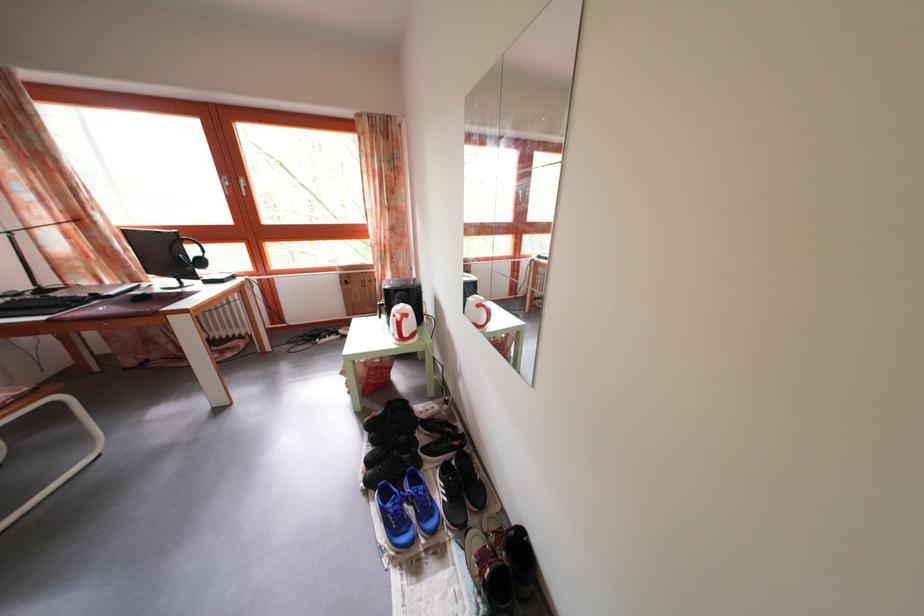
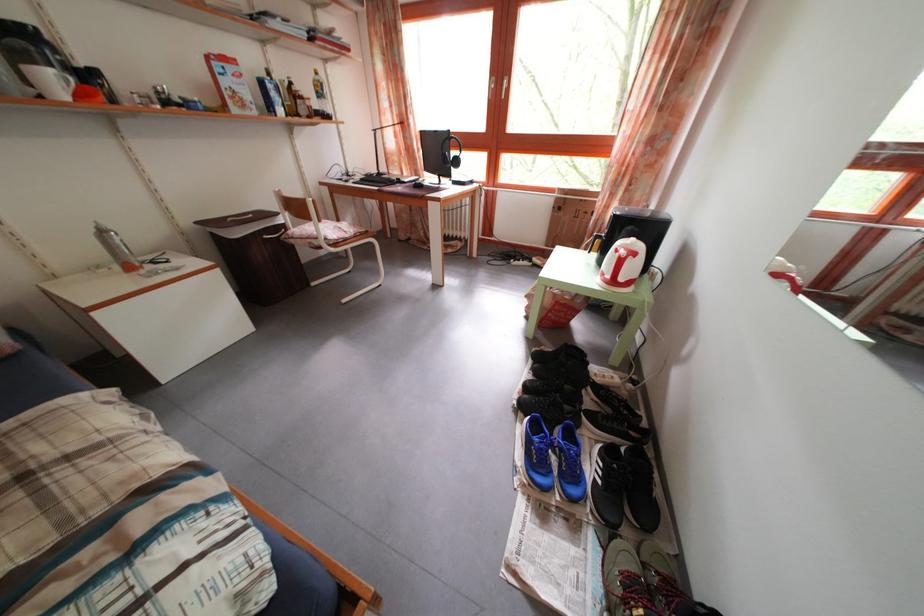
In the second image, find the point that corresponds to (x=445, y=501) in the first image.

(599, 477)